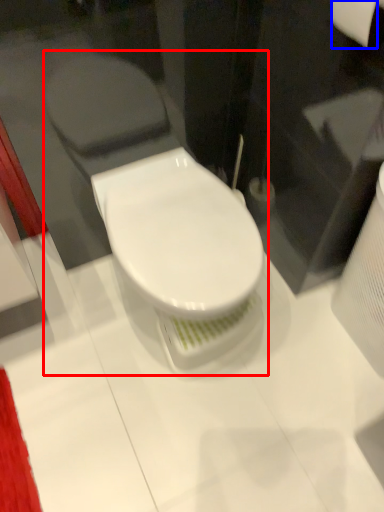
Question: Which object is further to the camera taking this photo, toilet (highlighted by a red box) or toilet paper (highlighted by a blue box)?

Choices:
 (A) toilet
 (B) toilet paper

Answer: (A)